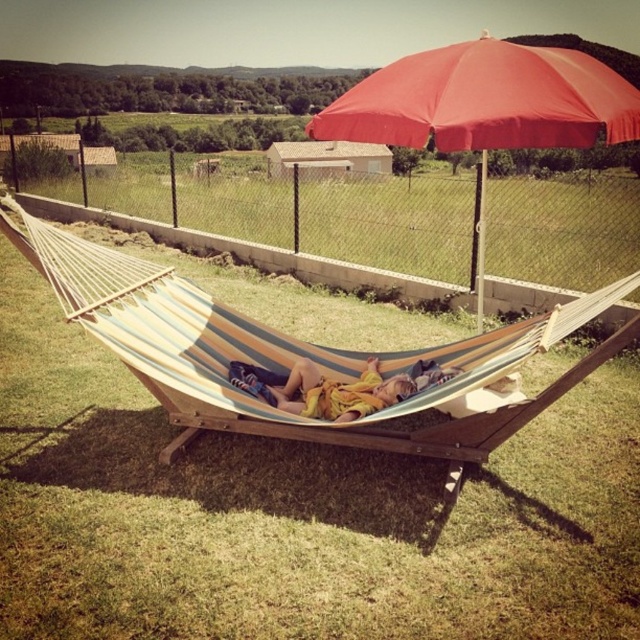
Who is positioned more to the left, striped fabric hammock at center or red fabric umbrella at upper center?

striped fabric hammock at center is more to the left.

Can you confirm if striped fabric hammock at center is positioned above red fabric umbrella at upper center?

Actually, striped fabric hammock at center is below red fabric umbrella at upper center.

Is point (593, 307) less distant than point (464, 132)?

No.

The width and height of the screenshot is (640, 640). In order to click on striped fabric hammock at center in this screenshot , I will do `click(291, 353)`.

Does red fabric umbrella at upper center appear on the left side of yellow fabric at center?

In fact, red fabric umbrella at upper center is to the right of yellow fabric at center.

Describe the element at coordinates (484, 104) in the screenshot. I see `red fabric umbrella at upper center` at that location.

Image resolution: width=640 pixels, height=640 pixels. What are the coordinates of `red fabric umbrella at upper center` in the screenshot? It's located at (484, 104).

Who is positioned more to the right, striped fabric hammock at center or yellow fabric at center?

From the viewer's perspective, yellow fabric at center appears more on the right side.

Can you confirm if striped fabric hammock at center is shorter than yellow fabric at center?

No, striped fabric hammock at center is not shorter than yellow fabric at center.

Does point (502, 364) lie behind point (340, 413)?

That is False.

You are a GUI agent. You are given a task and a screenshot of the screen. Output one action in this format:
    pyautogui.click(x=<x>, y=<y>)
    Task: Click on the striped fabric hammock at center
    The image size is (640, 640).
    Given the screenshot: What is the action you would take?
    pyautogui.click(x=291, y=353)